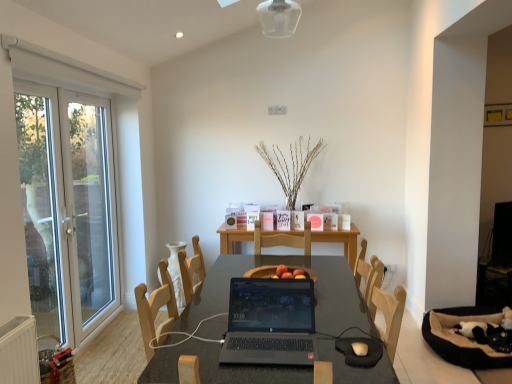
Question: From the image's perspective, is matte white mouse at center above white glass screen door at left, which is the second screen door in back-to-front order?

Choices:
 (A) yes
 (B) no

Answer: (B)

Question: Can you confirm if matte white mouse at center is positioned to the right of white glass screen door at left, the first screen door positioned from the front?

Choices:
 (A) yes
 (B) no

Answer: (A)

Question: Is matte white mouse at center looking in the opposite direction of white glass screen door at left, the first screen door positioned from the front?

Choices:
 (A) no
 (B) yes

Answer: (A)

Question: Could you tell me if matte white mouse at center is turned towards white glass screen door at left, which is the second screen door in back-to-front order?

Choices:
 (A) no
 (B) yes

Answer: (A)

Question: From a real-world perspective, does matte white mouse at center stand above white glass screen door at left, the first screen door positioned from the front?

Choices:
 (A) no
 (B) yes

Answer: (A)

Question: Based on their sizes in the image, would you say white glass screen door at left, which is the second screen door in back-to-front order, is bigger or smaller than matte white mouse at center?

Choices:
 (A) big
 (B) small

Answer: (A)

Question: Is point click(x=38, y=89) closer or farther from the camera than point click(x=364, y=342)?

Choices:
 (A) closer
 (B) farther

Answer: (B)

Question: From the image's perspective, is white glass screen door at left, the first screen door positioned from the front, positioned above or below matte white mouse at center?

Choices:
 (A) below
 (B) above

Answer: (B)

Question: From a real-world perspective, relative to matte white mouse at center, is white glass screen door at left, which is the second screen door in back-to-front order, vertically above or below?

Choices:
 (A) below
 (B) above

Answer: (B)

Question: Is black glossy table at center in front of or behind white glass screen door at left, positioned as the 1th screen door in back-to-front order, in the image?

Choices:
 (A) front
 (B) behind

Answer: (A)

Question: Is black glossy table at center situated inside white glass screen door at left, positioned as the 1th screen door in back-to-front order, or outside?

Choices:
 (A) outside
 (B) inside

Answer: (A)

Question: From the image's perspective, relative to white glass screen door at left, the second screen door from the front, is black glossy table at center above or below?

Choices:
 (A) below
 (B) above

Answer: (A)

Question: Considering the positions of point (324, 360) and point (81, 195), is point (324, 360) closer or farther from the camera than point (81, 195)?

Choices:
 (A) farther
 (B) closer

Answer: (B)

Question: Is matte white mouse at center bigger or smaller than black glossy table at center?

Choices:
 (A) big
 (B) small

Answer: (B)

Question: From the image's perspective, is matte white mouse at center above or below black glossy table at center?

Choices:
 (A) below
 (B) above

Answer: (B)